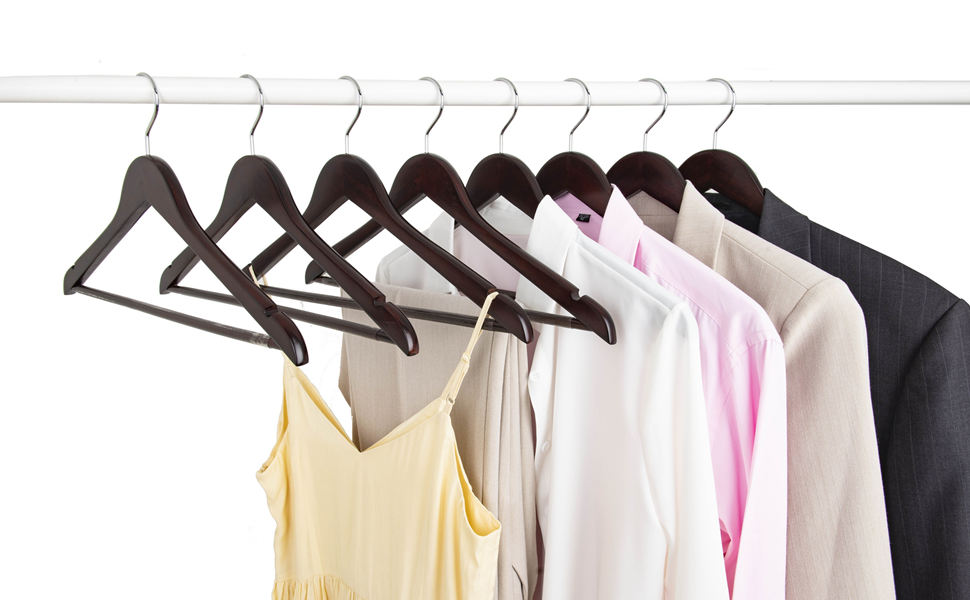
Locate an element on the screen. clothing on hangers is located at coordinates (398, 476), (481, 402), (664, 381), (742, 380), (805, 375), (948, 326).